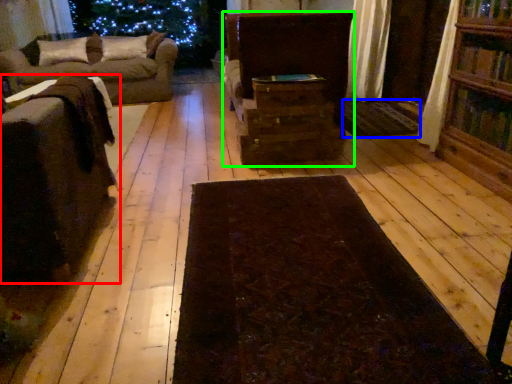
Question: Which is farther away from furniture (highlighted by a red box)? mat (highlighted by a blue box) or furniture (highlighted by a green box)?

Choices:
 (A) mat
 (B) furniture

Answer: (A)